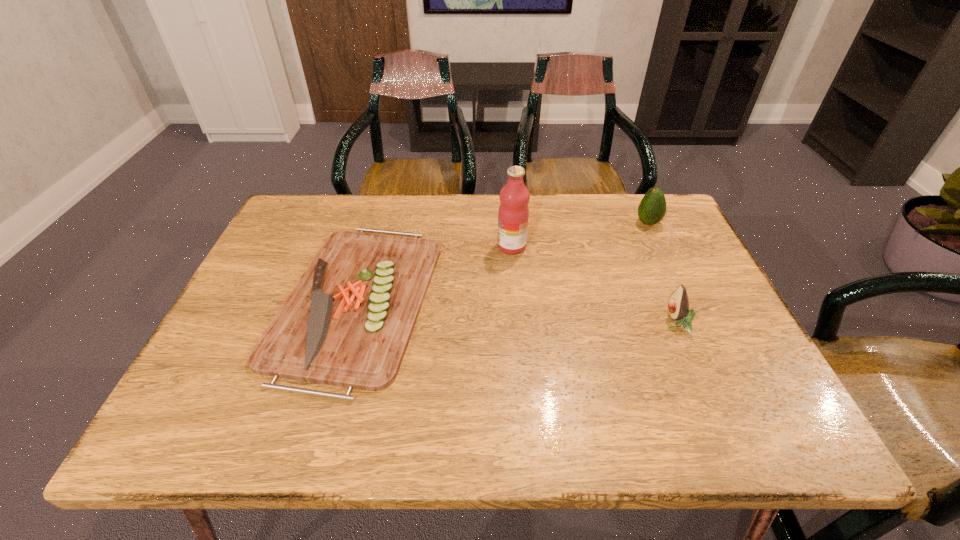
This screenshot has height=540, width=960. Identify the location of free space that satisfies the following two spatial constraints: 1. on the back side of the shortest object; 2. on the left side of the farther avocado. (379, 223).

What are the coordinates of `free region that satisfies the following two spatial constraints: 1. on the front side of the farther avocado; 2. on the seed side of the nearer avocado` in the screenshot? It's located at (695, 323).